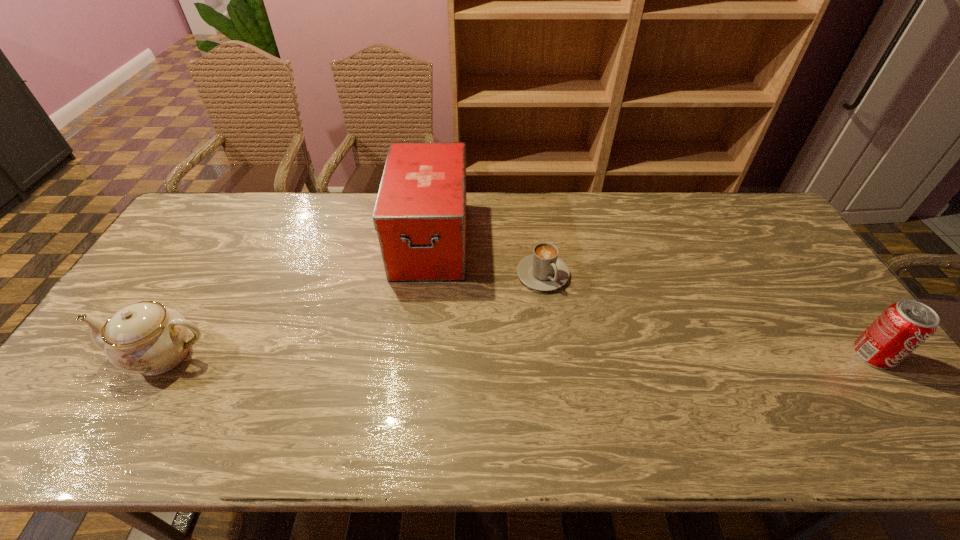
You are a GUI agent. You are given a task and a screenshot of the screen. Output one action in this format:
    pyautogui.click(x=<x>, y=<y>)
    Task: Click on the unoccupied position between the soda can and the tallest object
    The height and width of the screenshot is (540, 960).
    Given the screenshot: What is the action you would take?
    pyautogui.click(x=652, y=298)

Locate an element on the screen. free space between the leftmost object and the tallest object is located at coordinates (298, 298).

I want to click on free space between the soda can and the leftmost object, so click(x=519, y=355).

The image size is (960, 540). Identify the location of object that is the second closest to the tallest object. (146, 337).

Locate an element on the screen. object that can be found as the second closest to the shortest object is located at coordinates (903, 326).

Find the location of a particular element. The width and height of the screenshot is (960, 540). free spot that satisfies the following two spatial constraints: 1. on the front side of the third object from left to right; 2. on the left side of the first-aid kit is located at coordinates (426, 274).